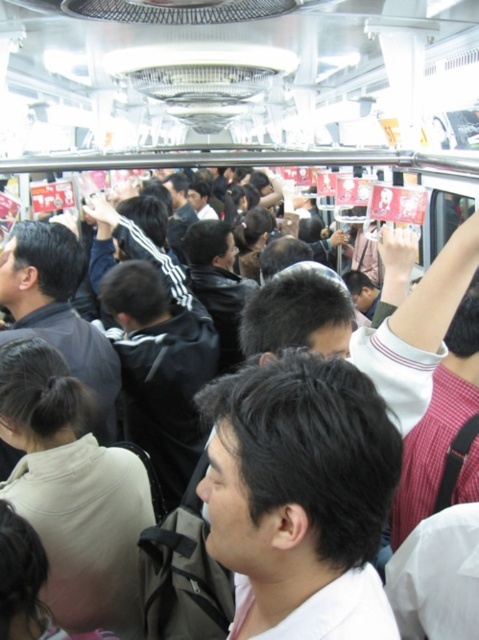
You are a photographer trying to capture a candid shot of the black matte hair at center in the crowded subway scene. Your camera is currently positioned at the same level as the hair. Considering the distance between them, can you safely assume that the camera is close enough to capture clear facial details without zooming?

The black matte hair at center and camera are 28.41 inches apart from each other, which is a close distance. However, since the question mentions capturing clear facial details without zooming, the answer would depend on the camera lens and resolution. But based on the given distance alone, the proximity suggests it might be possible if the camera has sufficient resolution and the lighting is adequate. However, the provided information doesn not specify camera specifications, so we can only confirm the clos

You are a passenger on a crowded train and want to move towards the door located at the front of the train. There is a person with black matte hair at center in your way. Given their position at coordinates approximately 0.775 on the x and 0.628 on the y axis, can you estimate whether this person is closer to the door than you are?

The person with black matte hair at center is located at coordinates approximately 0.775 on the x and 0.628 on the y axis. Since the door is at the front of the train and the perspective is from the back, the person is closer to the door than you are.